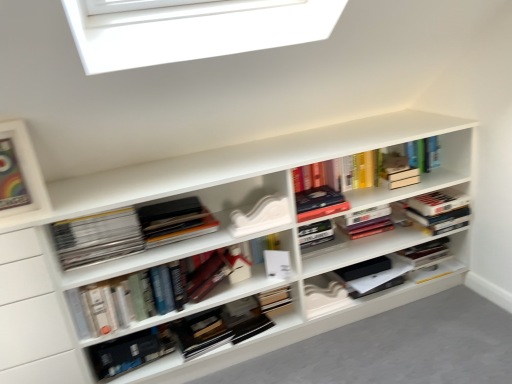
Question: Which is correct: white matte paperback book at center, the second paperback book from the left, is inside matte black books at left, the 6th book positioned from the right, or outside of it?

Choices:
 (A) outside
 (B) inside

Answer: (A)

Question: Considering the positions of white matte paperback book at center, the second paperback book from the left, and matte black books at left, the 6th book positioned from the right, in the image, is white matte paperback book at center, the second paperback book from the left, bigger or smaller than matte black books at left, the 6th book positioned from the right,?

Choices:
 (A) small
 (B) big

Answer: (A)

Question: Which of these objects is positioned farthest from the hardcover books at center, acting as the first book starting from the right?

Choices:
 (A) hardcover book at center, acting as the 2th book starting from the right
 (B) matte black books at left, which is the first book in left-to-right order
 (C) hardcover book at center, arranged as the 5th book when viewed from the right
 (D) white matte window at upper center
 (E) hardcover books at center, the 4th book from the left

Answer: (C)

Question: Which of these objects is positioned farthest from the matte red paperback book at center, which is the 2th paperback book from right to left?

Choices:
 (A) white matte window at upper center
 (B) matte black books at left, the 6th book positioned from the right
 (C) hardcover books at center, arranged as the fourth book when viewed from the right
 (D) matte wooden picture frame at upper left
 (E) white matte bookshelf at center

Answer: (A)